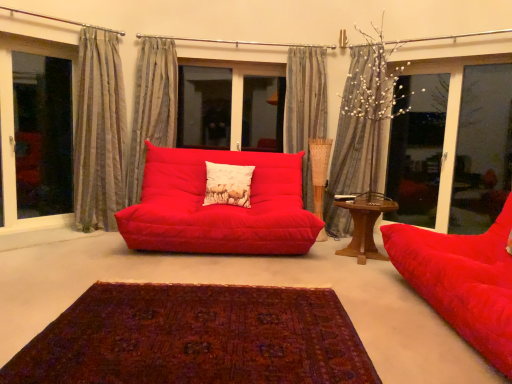
Question: Is gray striped curtain at upper center, the 2th curtain in the right-to-left sequence, at the left side of wooden table at right?

Choices:
 (A) no
 (B) yes

Answer: (B)

Question: Does gray striped curtain at upper center, the 2th curtain in the right-to-left sequence, have a lesser width compared to wooden table at right?

Choices:
 (A) yes
 (B) no

Answer: (A)

Question: From a real-world perspective, is gray striped curtain at upper center, arranged as the 3th curtain when viewed from the left, under wooden table at right?

Choices:
 (A) yes
 (B) no

Answer: (B)

Question: Does gray striped curtain at upper center, the 2th curtain in the right-to-left sequence, have a greater width compared to wooden table at right?

Choices:
 (A) no
 (B) yes

Answer: (A)

Question: Does gray striped curtain at upper center, arranged as the 3th curtain when viewed from the left, lie behind wooden table at right?

Choices:
 (A) no
 (B) yes

Answer: (B)

Question: From the image's perspective, is gray striped curtain at upper right, which ranks as the 1th curtain in right-to-left order, located above or below striped fabric curtain at left, the 1th curtain in the left-to-right sequence?

Choices:
 (A) above
 (B) below

Answer: (B)

Question: Is point (342, 107) positioned closer to the camera than point (113, 48)?

Choices:
 (A) farther
 (B) closer

Answer: (A)

Question: Is gray striped curtain at upper right, the fourth curtain positioned from the left, bigger or smaller than striped fabric curtain at left, placed as the fourth curtain when sorted from right to left?

Choices:
 (A) big
 (B) small

Answer: (A)

Question: Looking at their shapes, would you say gray striped curtain at upper right, the fourth curtain positioned from the left, is wider or thinner than striped fabric curtain at left, the 1th curtain in the left-to-right sequence?

Choices:
 (A) thin
 (B) wide

Answer: (B)

Question: In the image, is textured gray curtain at center, marked as the second curtain in a left-to-right arrangement, on the left side or the right side of striped fabric curtain at left, placed as the fourth curtain when sorted from right to left?

Choices:
 (A) left
 (B) right

Answer: (B)

Question: Which is correct: textured gray curtain at center, marked as the second curtain in a left-to-right arrangement, is inside striped fabric curtain at left, placed as the fourth curtain when sorted from right to left, or outside of it?

Choices:
 (A) outside
 (B) inside

Answer: (A)

Question: Looking at their shapes, would you say textured gray curtain at center, acting as the third curtain starting from the right, is wider or thinner than striped fabric curtain at left, placed as the fourth curtain when sorted from right to left?

Choices:
 (A) wide
 (B) thin

Answer: (A)

Question: In terms of height, does textured gray curtain at center, marked as the second curtain in a left-to-right arrangement, look taller or shorter compared to striped fabric curtain at left, the 1th curtain in the left-to-right sequence?

Choices:
 (A) short
 (B) tall

Answer: (A)

Question: Looking at the image, does gray striped curtain at upper right, which ranks as the 1th curtain in right-to-left order, seem bigger or smaller compared to matte red beanbag at right, acting as the first studio couch starting from the right?

Choices:
 (A) small
 (B) big

Answer: (A)

Question: Would you say gray striped curtain at upper right, which ranks as the 1th curtain in right-to-left order, is inside or outside matte red beanbag at right, which is the 2th studio couch from left to right?

Choices:
 (A) outside
 (B) inside

Answer: (A)